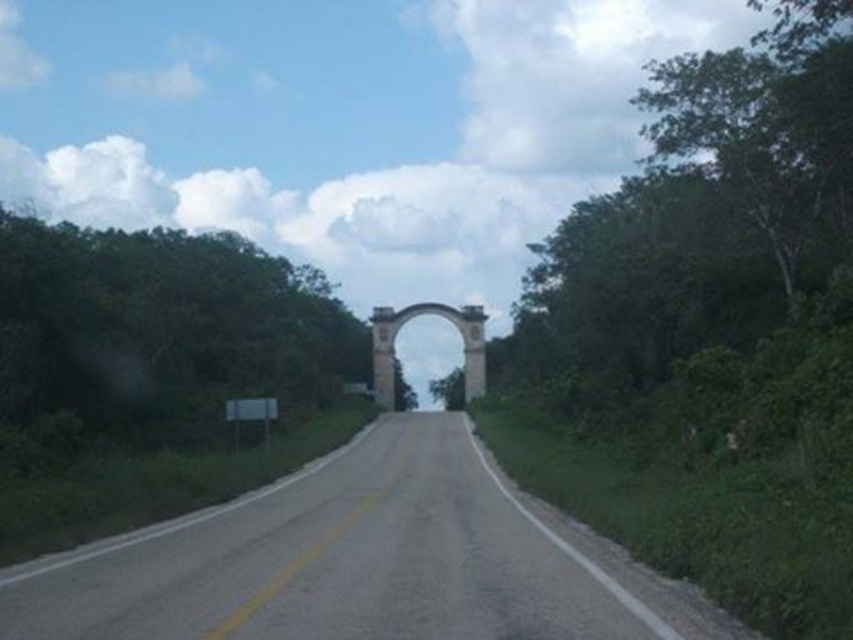
Question: Which point appears farthest from the camera in this image?

Choices:
 (A) (187, 564)
 (B) (379, 336)

Answer: (B)

Question: Does asphalt road at center have a greater width compared to white stone archway at center?

Choices:
 (A) no
 (B) yes

Answer: (A)

Question: Does asphalt road at center appear on the left side of white stone archway at center?

Choices:
 (A) no
 (B) yes

Answer: (A)

Question: Is asphalt road at center below white stone archway at center?

Choices:
 (A) yes
 (B) no

Answer: (A)